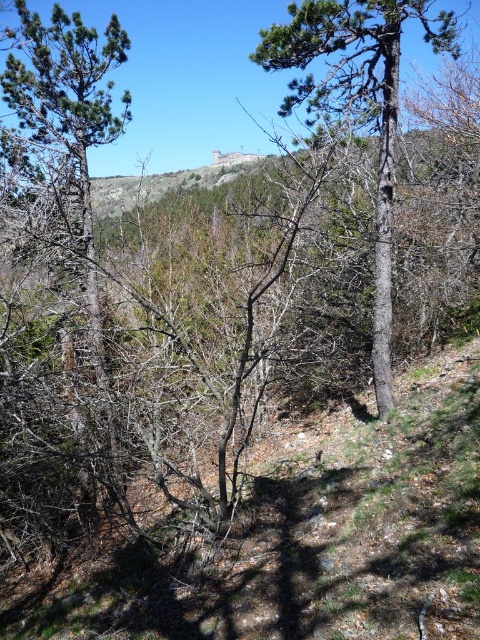
You are a hiker trying to navigate through the forest. You see a smooth bark tree at center and a green pine tree at left. Which tree has a wider trunk?

The smooth bark tree at center has a wider trunk than the green pine tree at left.

You are standing in the forest and see the smooth bark tree at center and the green pine tree at left. Which tree is positioned to the right of the other?

The smooth bark tree at center is positioned to the right of the green pine tree at left.

From the picture: You are planning to build a small cabin in this forest. You want to use wood from the trees. Which tree would you choose between the smooth bark tree at center and the green pine tree at left if you need a larger tree for more wood?

The smooth bark tree at center is larger in size than the green pine tree at left, so you should choose the smooth bark tree at center for more wood.